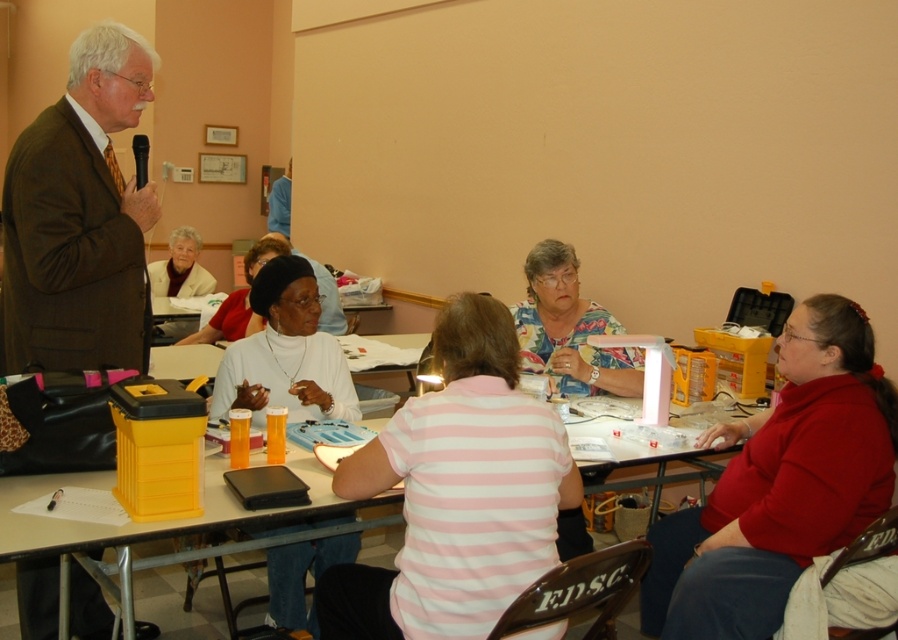
Question: Is brown textured suit at upper left above floral fabric blouse at center?

Choices:
 (A) yes
 (B) no

Answer: (A)

Question: Which of the following is the closest to the observer?

Choices:
 (A) floral fabric blouse at center
 (B) pink striped shirt at center

Answer: (B)

Question: Does pink striped shirt at center appear on the right side of white fabric shirt at center?

Choices:
 (A) yes
 (B) no

Answer: (A)

Question: Is brown textured suit at upper left smaller than floral fabric blouse at center?

Choices:
 (A) no
 (B) yes

Answer: (A)

Question: Which point is closer to the camera?

Choices:
 (A) (170, 276)
 (B) (267, 256)
 (C) (797, 349)
 (D) (270, 268)

Answer: (C)

Question: Which point is farther to the camera?

Choices:
 (A) white fabric shirt at center
 (B) matte black hat at center
 (C) red matte sweater at lower right

Answer: (A)